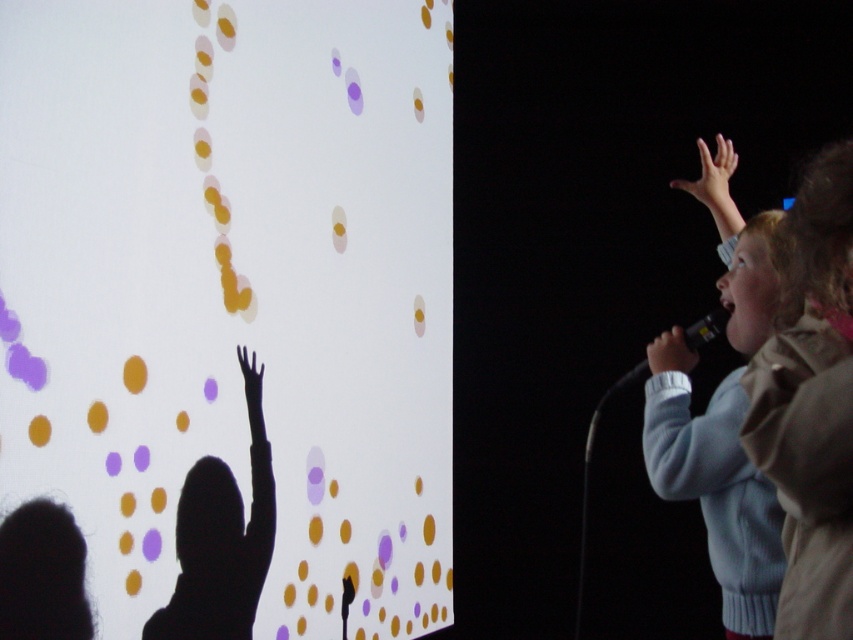
Does matte polka dots at upper center appear on the left side of light brown jacket at right?

Yes, matte polka dots at upper center is to the left of light brown jacket at right.

Is matte polka dots at upper center taller than light brown jacket at right?

Yes, matte polka dots at upper center is taller than light brown jacket at right.

Locate an element on the screen. The height and width of the screenshot is (640, 853). matte polka dots at upper center is located at coordinates (224, 317).

Is smooth skin hand at upper right closer to camera compared to black matte hand at upper left?

No, it is behind black matte hand at upper left.

Is smooth skin hand at upper right below black matte hand at upper left?

No.

Does point (648, 348) lie behind point (260, 388)?

No, it is in front of (260, 388).

I want to click on smooth skin hand at upper right, so click(x=670, y=353).

Does light blue sweater at right have a smaller size compared to silhouette figure at left?

No, light blue sweater at right is not smaller than silhouette figure at left.

Is the position of light blue sweater at right more distant than that of silhouette figure at left?

No, light blue sweater at right is in front of silhouette figure at left.

At what (x,y) coordinates should I click in order to perform the action: click on light blue sweater at right. Please return your answer as a coordinate pair (x, y). The height and width of the screenshot is (640, 853). Looking at the image, I should click on (718, 493).

Image resolution: width=853 pixels, height=640 pixels. In order to click on light blue sweater at right in this screenshot , I will do `click(718, 493)`.